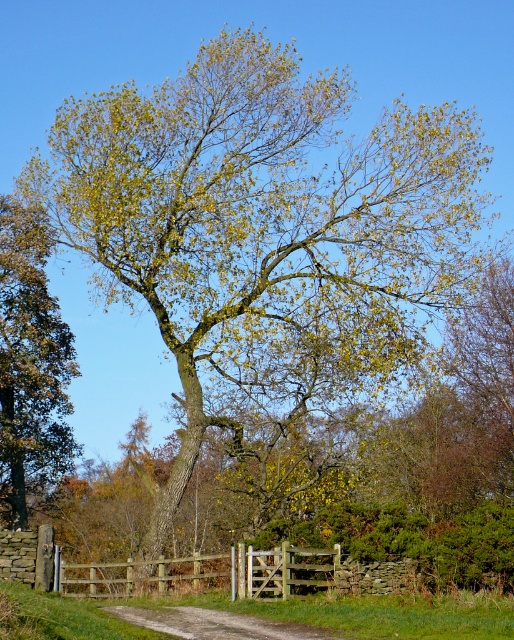
From the picture: You are standing in a field and see the green leafy tree at left and the wooden gate at center. Which object is closer to you?

The green leafy tree at left is closer to you because it is further to the viewer than the wooden gate at center.

You are standing at the entrance of the rural landscape and notice the wooden gate at center. If you want to walk through the gate, which direction should you move relative to your current position?

The wooden gate at center is located at point 0.897 on the x and 0.469 on the y coordinates, so you should move towards the center of the scene to reach it.